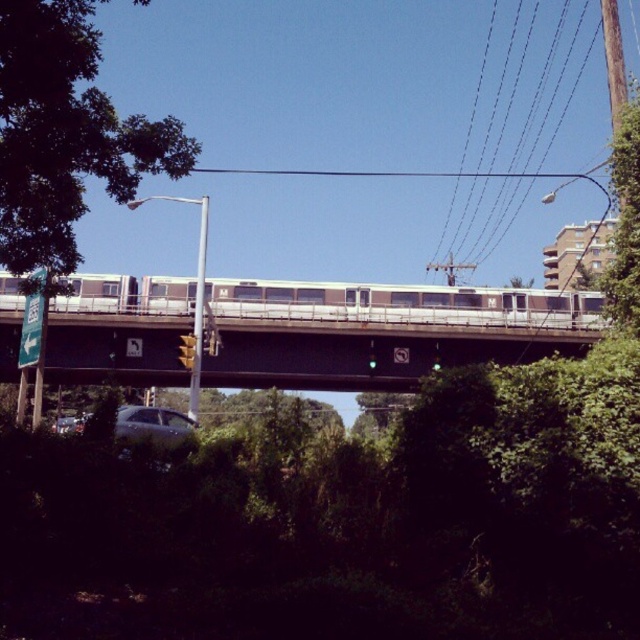
Question: Observing the image, what is the correct spatial positioning of silver metallic train at center in reference to satin silver sedan at lower left?

Choices:
 (A) above
 (B) below

Answer: (A)

Question: Based on their relative distances, which object is farther from the metallic gray bridge at center?

Choices:
 (A) green leafy tree at upper left
 (B) silver metallic pole at center
 (C) satin silver sedan at lower left
 (D) black wire at upper center

Answer: (D)

Question: Among these objects, which one is nearest to the camera?

Choices:
 (A) silver metallic train at center
 (B) metallic gray bridge at center
 (C) silver metallic pole at center
 (D) black wire at upper center

Answer: (A)

Question: Which point is farther to the camera?

Choices:
 (A) silver metallic train at center
 (B) black wire at upper center

Answer: (B)

Question: Is green leafy tree at upper left in front of satin silver sedan at lower left?

Choices:
 (A) yes
 (B) no

Answer: (A)

Question: Is green leafy tree at upper left smaller than metallic gray bridge at center?

Choices:
 (A) no
 (B) yes

Answer: (A)